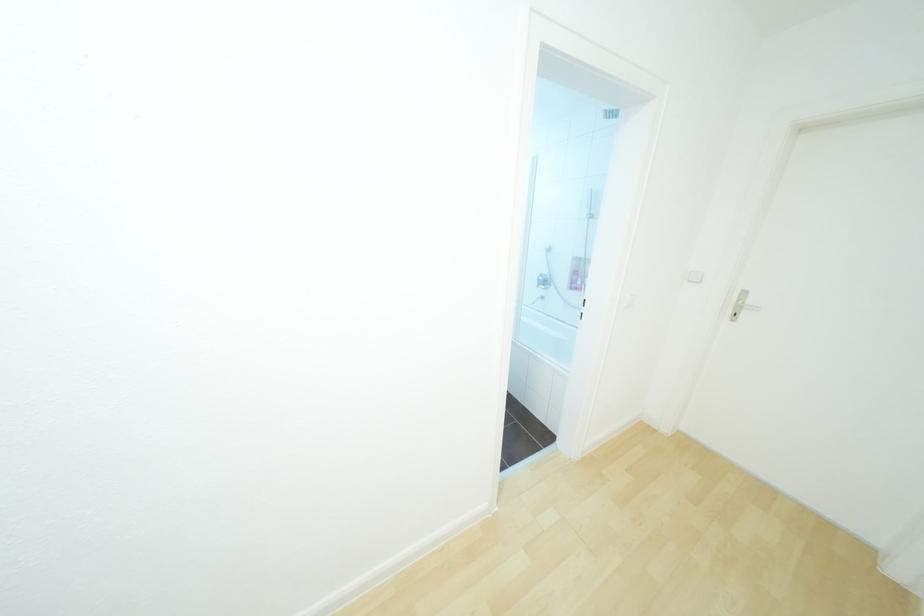
What do you see at coordinates (743, 309) in the screenshot? I see `the silver door handle` at bounding box center [743, 309].